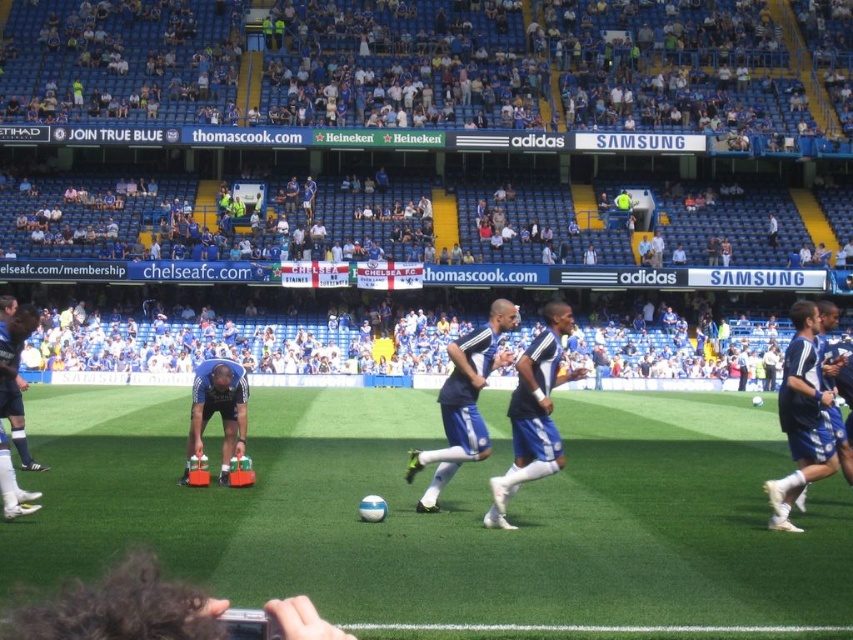
Who is taller, white synthetic turf at center or blue fabric shorts at center?

blue fabric shorts at center

Consider the image. Does white synthetic turf at center have a smaller size compared to blue fabric shorts at center?

Indeed, white synthetic turf at center has a smaller size compared to blue fabric shorts at center.

Image resolution: width=853 pixels, height=640 pixels. What do you see at coordinates (445, 512) in the screenshot?
I see `white synthetic turf at center` at bounding box center [445, 512].

The width and height of the screenshot is (853, 640). What are the coordinates of `white synthetic turf at center` in the screenshot? It's located at (445, 512).